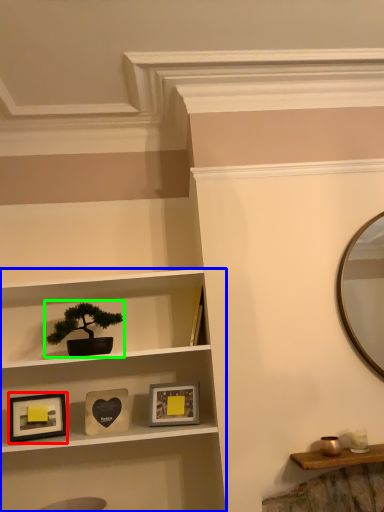
Question: Which object is the closest to the picture frame (highlighted by a red box)? Choose among these: shelf (highlighted by a blue box) or houseplant (highlighted by a green box).

Choices:
 (A) shelf
 (B) houseplant

Answer: (B)